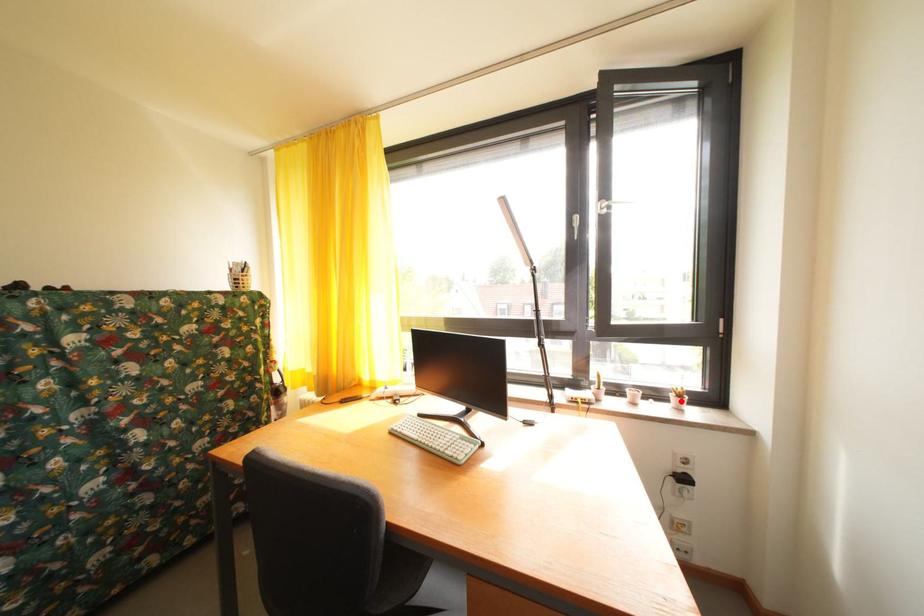
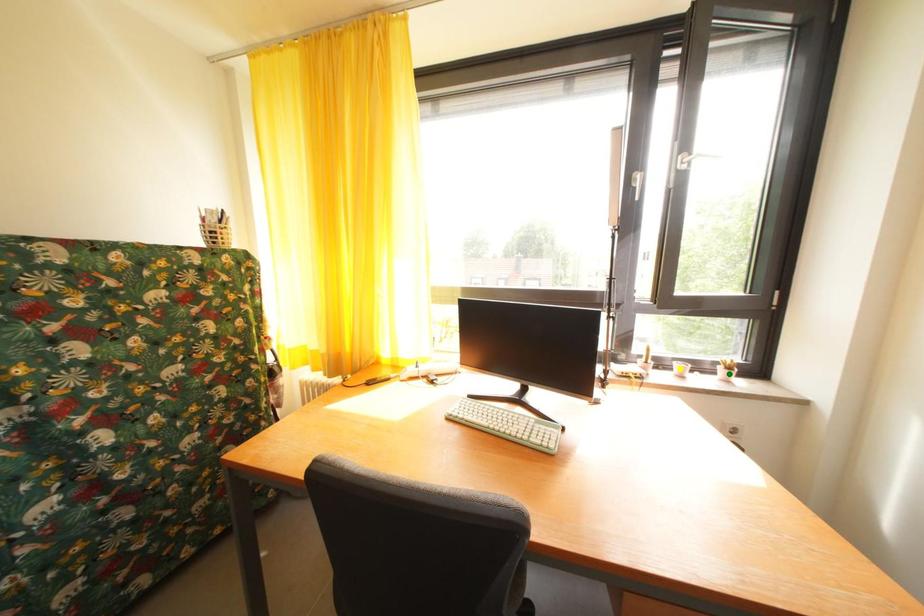
Question: I am providing you with two images of the same scene from different viewpoints. A red point is marked on the first image. You are given multiple points on the second image. Which point in image 2 is actually the same real-world point as the red point in image 1?

Choices:
 (A) blue point
 (B) yellow point
 (C) green point

Answer: (C)